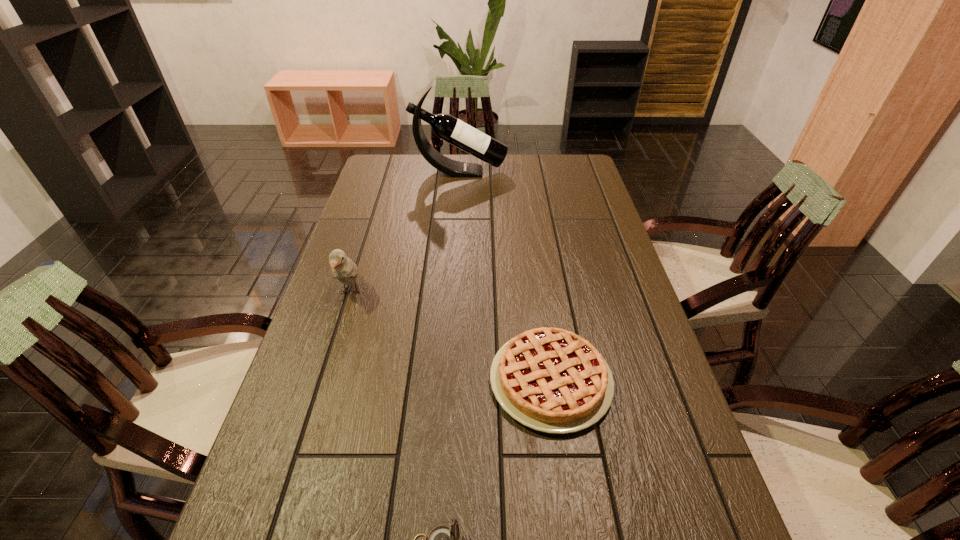
This screenshot has height=540, width=960. What are the coordinates of `the tallest object` in the screenshot? It's located at (447, 127).

At what (x,y) coordinates should I click in order to perform the action: click on wine bottle. Please return your answer as a coordinate pair (x, y). The width and height of the screenshot is (960, 540). Looking at the image, I should click on (447, 127).

This screenshot has width=960, height=540. Find the location of `the third nearest object`. the third nearest object is located at coordinates (343, 269).

Identify the location of the second tallest object. This screenshot has height=540, width=960. (343, 269).

This screenshot has height=540, width=960. In order to click on pie in this screenshot , I will do `click(552, 380)`.

At what (x,y) coordinates should I click in order to perform the action: click on the shortest object. Please return your answer as a coordinate pair (x, y). This screenshot has height=540, width=960. Looking at the image, I should click on point(552,380).

The image size is (960, 540). What are the coordinates of `vacant space located 0.070m on the stand of the farthest object` in the screenshot? It's located at (524, 172).

You are a GUI agent. You are given a task and a screenshot of the screen. Output one action in this format:
    pyautogui.click(x=<x>, y=<y>)
    Task: Click on the free region located at the face of the leftmost object
    The height and width of the screenshot is (540, 960).
    Given the screenshot: What is the action you would take?
    pyautogui.click(x=324, y=379)

At what (x,y) coordinates should I click in order to perform the action: click on blank space located 0.180m on the front of the shortest object. Please return your answer as a coordinate pair (x, y). The image size is (960, 540). Looking at the image, I should click on (572, 530).

Find the location of a particular element. This screenshot has height=540, width=960. object that is at the far edge is located at coordinates (447, 127).